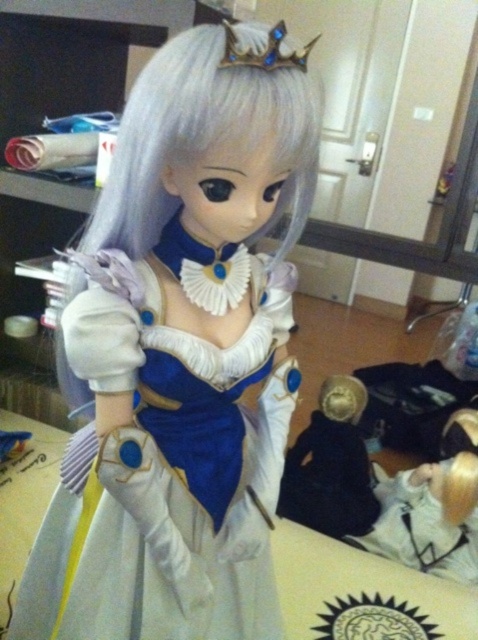
Does satin white dress at center have a greater height compared to black matte doll at lower right?

Yes, satin white dress at center is taller than black matte doll at lower right.

The width and height of the screenshot is (478, 640). Find the location of `satin white dress at center`. satin white dress at center is located at coordinates (181, 353).